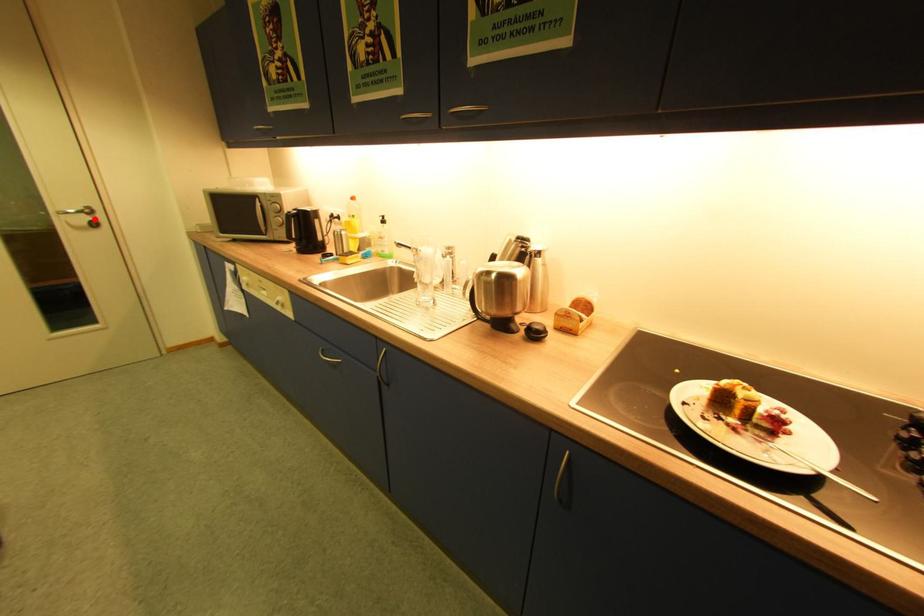
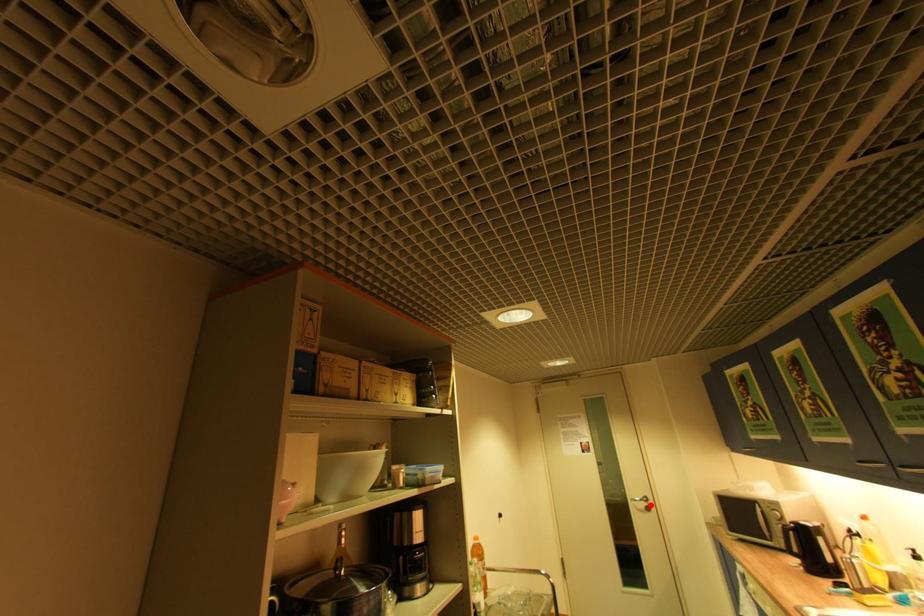
I am providing you with two images of the same scene from different viewpoints. A red point is marked on the first image and another point is marked on the second image. Is the marked point in image1 the same physical position as the marked point in image2?

Yes